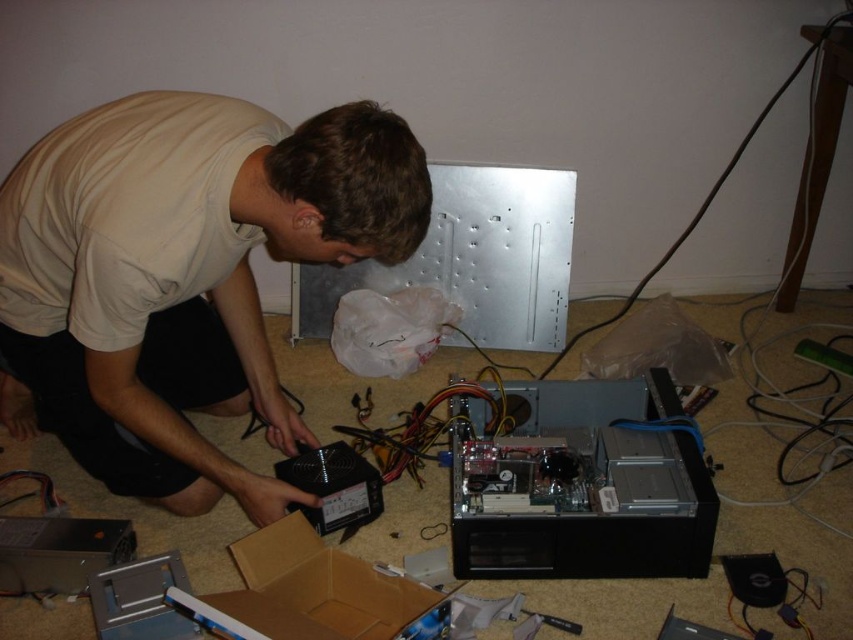
Question: Is black plastic power supply at center behind brown cardboard box at lower center?

Choices:
 (A) no
 (B) yes

Answer: (A)

Question: Which object appears closest to the camera in this image?

Choices:
 (A) black plastic power supply at center
 (B) brown cardboard box at lower center

Answer: (A)

Question: Is black plastic power supply at center positioned in front of brown cardboard box at lower center?

Choices:
 (A) yes
 (B) no

Answer: (A)

Question: Which object is closer to the camera taking this photo?

Choices:
 (A) brown cardboard box at lower center
 (B) black plastic power supply at center

Answer: (B)

Question: Is black plastic power supply at center below brown cardboard box at lower center?

Choices:
 (A) no
 (B) yes

Answer: (A)

Question: Which object is farther from the camera taking this photo?

Choices:
 (A) brown cardboard box at lower center
 (B) black plastic power supply at center

Answer: (A)